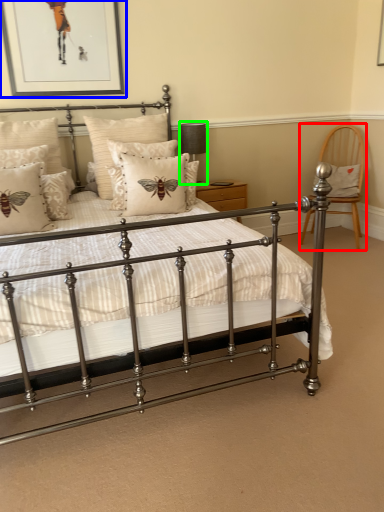
Question: Based on their relative distances, which object is nearer to chair (highlighted by a red box)? Choose from picture frame (highlighted by a blue box) and table lamp (highlighted by a green box).

Choices:
 (A) picture frame
 (B) table lamp

Answer: (B)